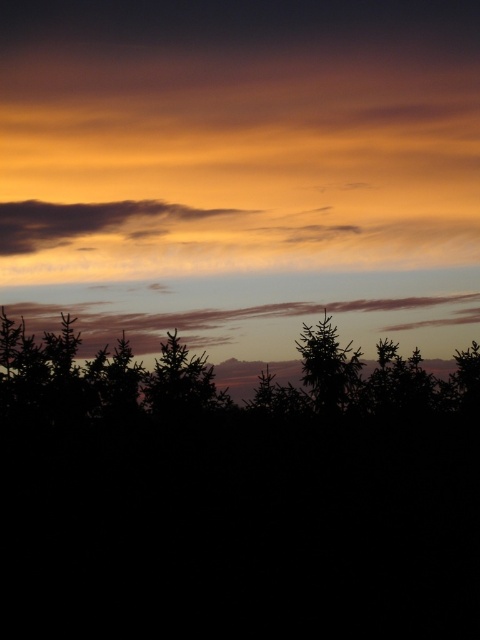
Consider the image. You are an artist trying to paint the sunset scene. You want to ensure the translucent orange cloud at upper center and the silhouette tree at center are proportionally accurate. Which object should you make wider in your painting?

The translucent orange cloud at upper center should be made wider than the silhouette tree at center in the painting since its width is larger according to the description.